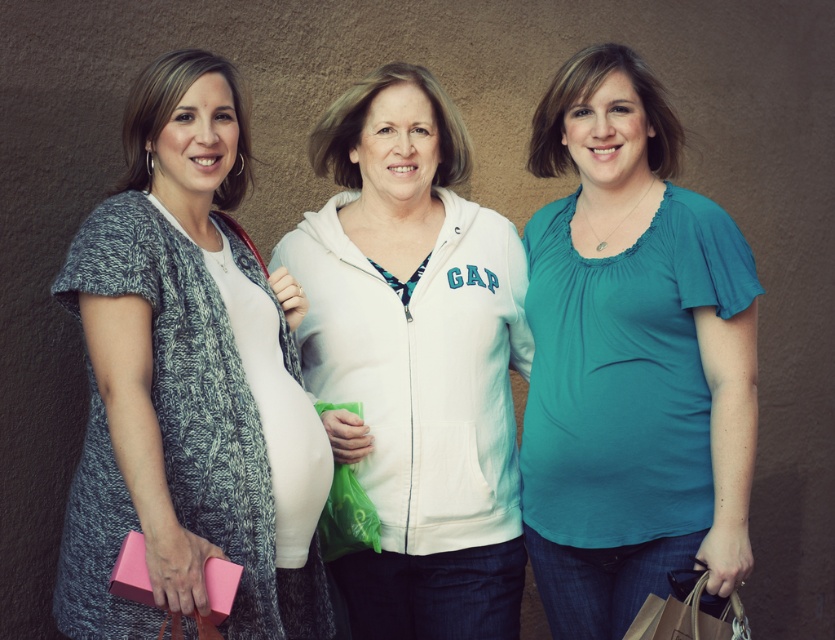
What is the color of the shirt at the point with coordinates (x=631, y=356)?

The teal matte shirt at center is located at point (x=631, y=356), so the color is teal.

You are a photographer adjusting your camera settings to focus on the knitted gray cardigan at left and the teal matte shirt at center. Which piece of clothing should you focus on first to ensure both are in sharp focus?

You should focus on the knitted gray cardigan at left first because it is closer to the viewer than the teal matte shirt at center, so focusing on the closer object will help both be in focus.